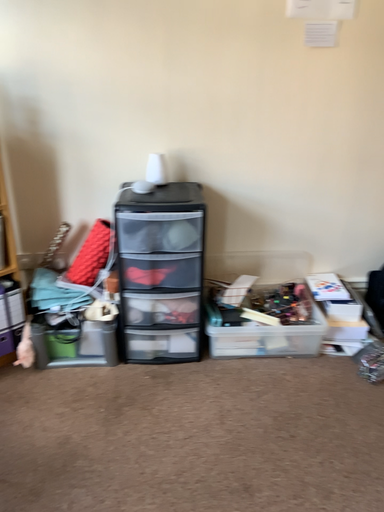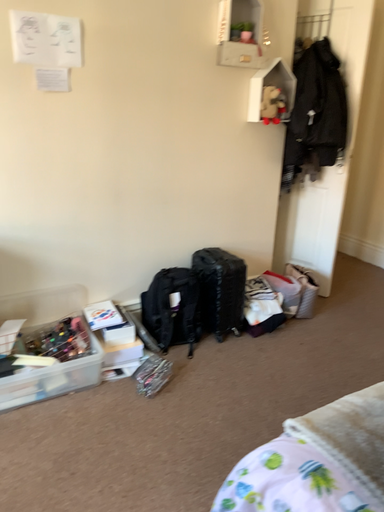
Question: How did the camera likely rotate when shooting the video?

Choices:
 (A) rotated right
 (B) rotated left

Answer: (A)